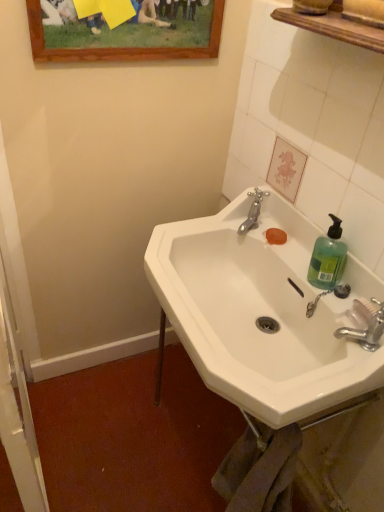
Question: In which direction should I rotate to look at silver metallic faucet at upper center, the 1th tap positioned from the left?

Choices:
 (A) right
 (B) left

Answer: (A)

Question: Is green translucent plastic at right wider than wooden picture frame at upper center?

Choices:
 (A) no
 (B) yes

Answer: (B)

Question: From the image's perspective, would you say green translucent plastic at right is positioned over wooden picture frame at upper center?

Choices:
 (A) yes
 (B) no

Answer: (B)

Question: From the image's perspective, is green translucent plastic at right under wooden picture frame at upper center?

Choices:
 (A) no
 (B) yes

Answer: (B)

Question: Considering the relative sizes of green translucent plastic at right and wooden picture frame at upper center in the image provided, is green translucent plastic at right smaller than wooden picture frame at upper center?

Choices:
 (A) no
 (B) yes

Answer: (B)

Question: Would you say green translucent plastic at right contains wooden picture frame at upper center?

Choices:
 (A) no
 (B) yes

Answer: (A)

Question: Is green translucent plastic at right taller than wooden picture frame at upper center?

Choices:
 (A) yes
 (B) no

Answer: (B)

Question: Is green translucent plastic at right positioned with its back to silver metallic faucet at lower right, the first tap positioned from the right?

Choices:
 (A) yes
 (B) no

Answer: (B)

Question: Does green translucent plastic at right have a smaller size compared to silver metallic faucet at lower right, acting as the second tap starting from the back?

Choices:
 (A) no
 (B) yes

Answer: (B)

Question: Is green translucent plastic at right completely or partially outside of silver metallic faucet at lower right, the second tap viewed from the left?

Choices:
 (A) yes
 (B) no

Answer: (A)

Question: Are green translucent plastic at right and silver metallic faucet at lower right, acting as the 1th tap starting from the bottom, beside each other?

Choices:
 (A) yes
 (B) no

Answer: (B)

Question: Are green translucent plastic at right and silver metallic faucet at lower right, acting as the second tap starting from the back, far apart?

Choices:
 (A) yes
 (B) no

Answer: (B)

Question: Is green translucent plastic at right surrounding silver metallic faucet at lower right, which ranks as the 1th tap in front-to-back order?

Choices:
 (A) no
 (B) yes

Answer: (A)

Question: From the image's perspective, does white ceramic sink at center appear lower than silver metallic faucet at upper center, arranged as the 2th tap when viewed from the front?

Choices:
 (A) no
 (B) yes

Answer: (B)